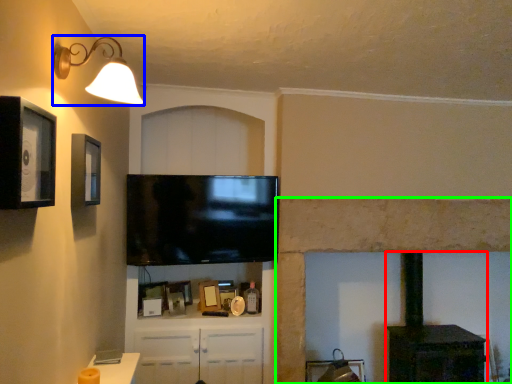
Question: Which object is positioned farthest from stove (highlighted by a red box)? Select from light fixture (highlighted by a blue box) and fireplace (highlighted by a green box).

Choices:
 (A) light fixture
 (B) fireplace

Answer: (A)